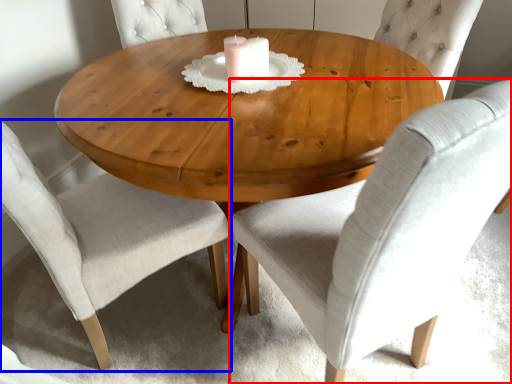
Question: Which object is closer to the camera taking this photo, chair (highlighted by a red box) or chair (highlighted by a blue box)?

Choices:
 (A) chair
 (B) chair

Answer: (A)